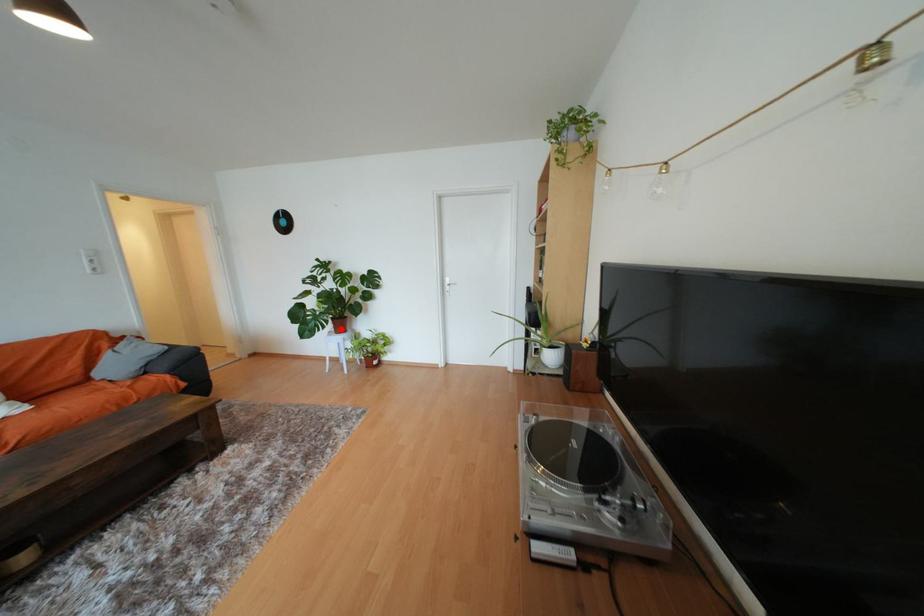
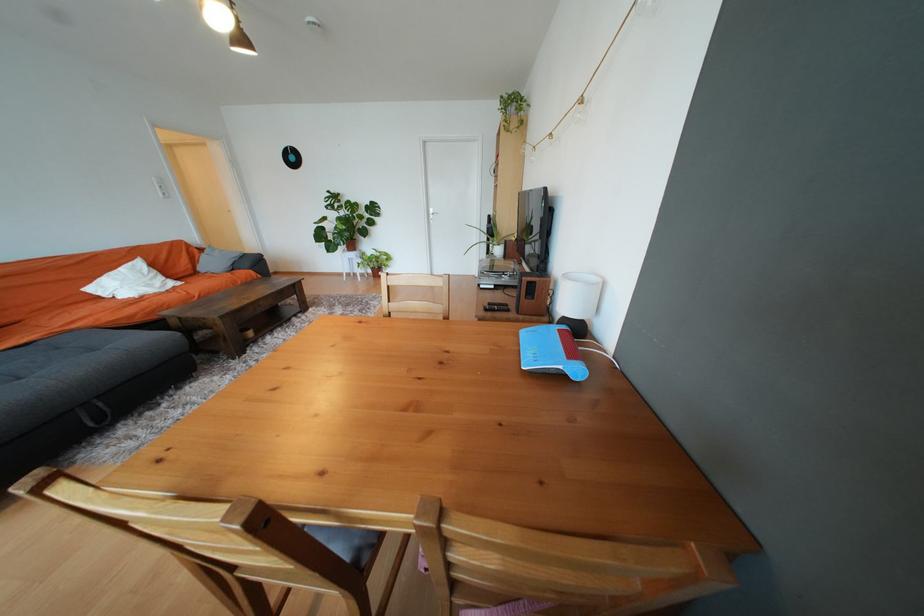
Where in the second image is the point corresponding to the highlighted location from the first image?

(354, 248)